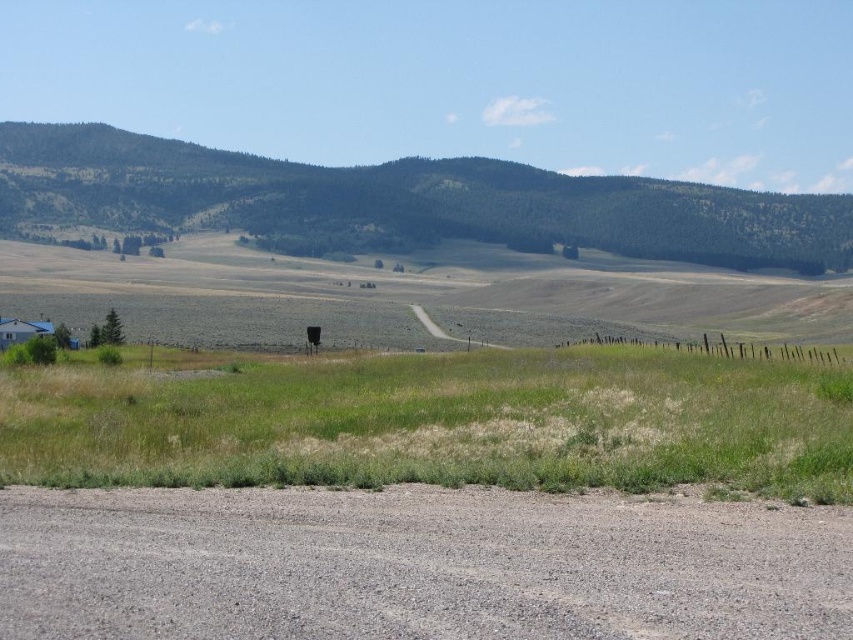
Does gray gravel dirt track at lower center have a greater height compared to green forested mountain at upper center?

No.

Is point (329, 621) more distant than point (715, 236)?

No, (329, 621) is closer to viewer.

Locate an element on the screen. gray gravel dirt track at lower center is located at coordinates (416, 564).

Is gray gravel dirt track at lower center positioned before green grass at lower center?

Yes, it is.

Can you confirm if gray gravel dirt track at lower center is positioned to the right of green grass at lower center?

Yes, gray gravel dirt track at lower center is to the right of green grass at lower center.

Locate an element on the screen. Image resolution: width=853 pixels, height=640 pixels. gray gravel dirt track at lower center is located at coordinates (416, 564).

Is point (608, 348) closer to viewer compared to point (570, 177)?

Yes, it is in front of point (570, 177).

Between green grass at lower center and green forested mountain at upper center, which one is positioned lower?

green grass at lower center

Who is more distant from viewer, (691, 472) or (235, 211)?

Positioned behind is point (235, 211).

Where is `green grass at lower center`? Image resolution: width=853 pixels, height=640 pixels. green grass at lower center is located at coordinates (439, 422).